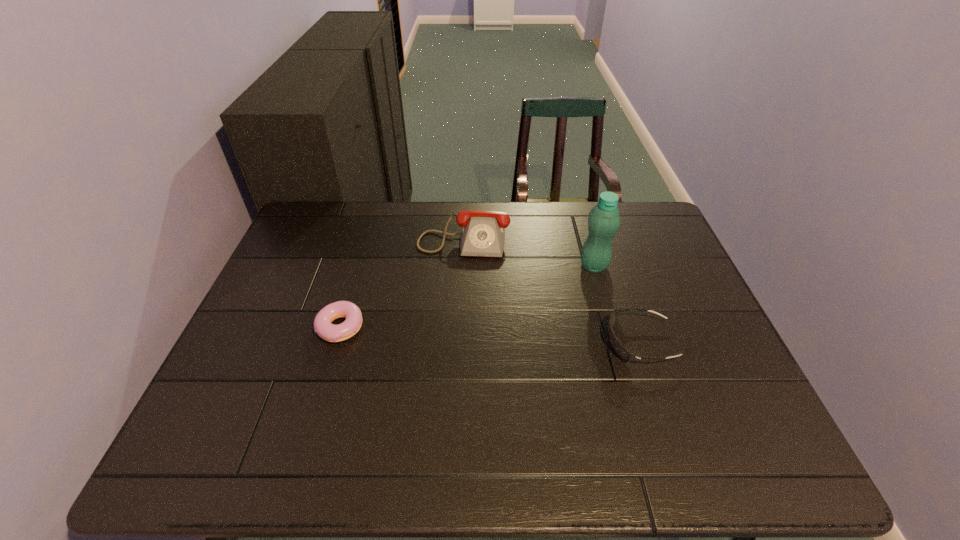
Locate an element on the screen. The width and height of the screenshot is (960, 540). empty space between the goggles and the shortest object is located at coordinates (490, 335).

This screenshot has width=960, height=540. Identify the location of vacant space in between the doughnut and the tallest object. (467, 296).

Locate an element on the screen. blank region between the goggles and the telephone is located at coordinates (552, 288).

I want to click on free spot between the telephone and the water bottle, so click(529, 251).

At what (x,y) coordinates should I click in order to perform the action: click on free spot between the doughnut and the goggles. Please return your answer as a coordinate pair (x, y). Looking at the image, I should click on (490, 335).

Choose which object is the nearest neighbor to the goggles. Please provide its 2D coordinates. Your answer should be formatted as a tuple, i.e. [(x, y)], where the tuple contains the x and y coordinates of a point satisfying the conditions above.

[(604, 219)]

Identify which object is the second nearest to the water bottle. Please provide its 2D coordinates. Your answer should be formatted as a tuple, i.e. [(x, y)], where the tuple contains the x and y coordinates of a point satisfying the conditions above.

[(483, 232)]

The width and height of the screenshot is (960, 540). Find the location of `blank space that satisfies the following two spatial constraints: 1. on the front side of the goggles; 2. on the lenses of the tallest object`. blank space that satisfies the following two spatial constraints: 1. on the front side of the goggles; 2. on the lenses of the tallest object is located at coordinates (615, 342).

Identify the location of vacant space that satisfies the following two spatial constraints: 1. on the back side of the water bottle; 2. on the left side of the leftmost object. This screenshot has width=960, height=540. (358, 266).

I want to click on free space that satisfies the following two spatial constraints: 1. on the back side of the tallest object; 2. on the right side of the shortest object, so click(x=358, y=266).